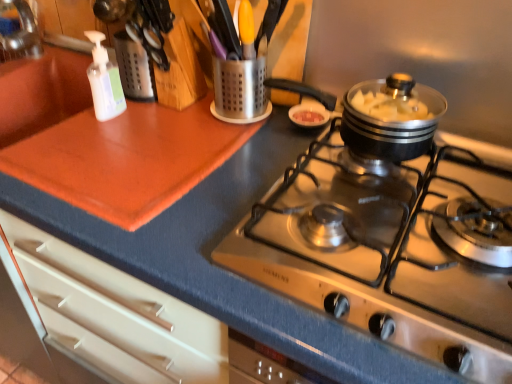
This screenshot has width=512, height=384. I want to click on vacant region in front of white translucent bottle at upper left, so click(x=93, y=150).